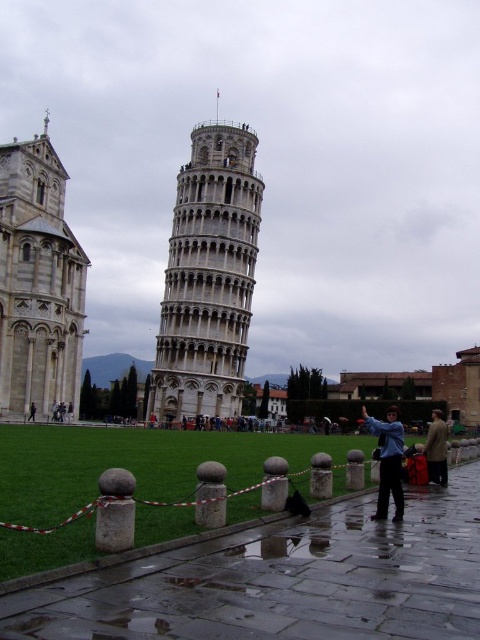
Question: Which of these objects is positioned farthest from the dark blue jeans at center?

Choices:
 (A) brown wool coat at center
 (B) white stone bell tower at left
 (C) blue fabric jacket at center

Answer: (A)

Question: Among these objects, which one is farthest from the camera?

Choices:
 (A) blue fabric jacket at center
 (B) brown wool coat at center

Answer: (B)

Question: Does blue fabric jacket at center have a greater width compared to dark blue jeans at center?

Choices:
 (A) yes
 (B) no

Answer: (A)

Question: Which of these objects is positioned closest to the stone tower at center?

Choices:
 (A) white stone bell tower at left
 (B) blue fabric jacket at center

Answer: (A)

Question: Can you confirm if stone tower at center is positioned below dark blue jeans at center?

Choices:
 (A) yes
 (B) no

Answer: (B)

Question: In this image, where is white stone bell tower at left located relative to brown wool coat at center?

Choices:
 (A) left
 (B) right

Answer: (A)